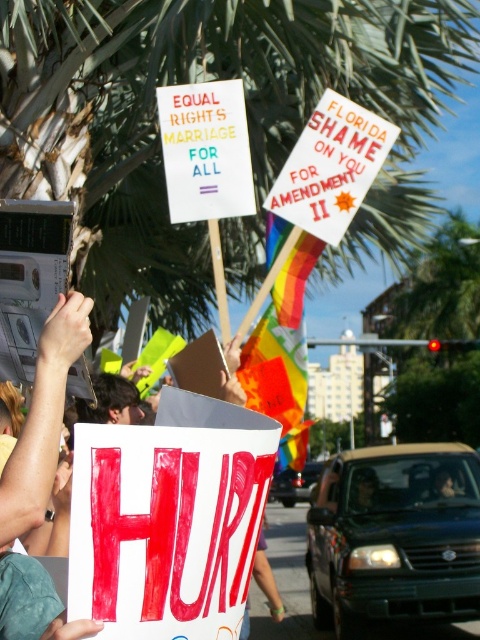
Question: Considering the real-world distances, which object is farthest from the white paper sign at center?

Choices:
 (A) white paper sign at upper center
 (B) green leafy palm tree at upper center

Answer: (B)

Question: Considering the relative positions of green leafy palm tree at upper center and white paper sign at upper center in the image provided, where is green leafy palm tree at upper center located with respect to white paper sign at upper center?

Choices:
 (A) below
 (B) above

Answer: (B)

Question: Which object is farther from the camera taking this photo?

Choices:
 (A) green leafy palm tree at upper center
 (B) white paper sign at upper center

Answer: (A)

Question: Does white paper sign at center appear over white paper sign at upper center?

Choices:
 (A) no
 (B) yes

Answer: (A)

Question: Estimate the real-world distances between objects in this image. Which object is farther from the white paper sign at center?

Choices:
 (A) white paper sign at upper center
 (B) green leafy palm tree at upper center

Answer: (B)

Question: Observing the image, what is the correct spatial positioning of white paper sign at center in reference to white paper sign at upper center?

Choices:
 (A) left
 (B) right

Answer: (A)